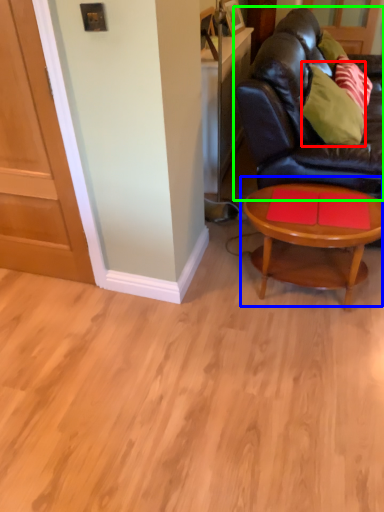
Question: Based on their relative distances, which object is farther from pillow (highlighted by a red box)? Choose from coffee table (highlighted by a blue box) and studio couch (highlighted by a green box).

Choices:
 (A) coffee table
 (B) studio couch

Answer: (A)